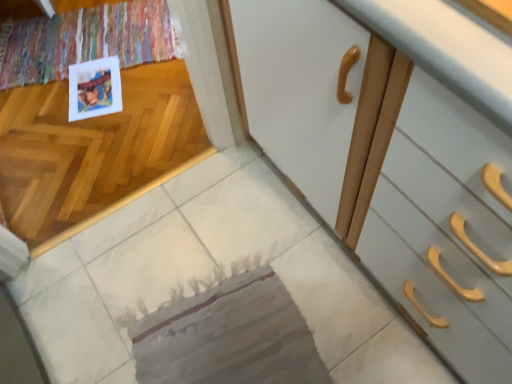
This screenshot has height=384, width=512. What are the coordinates of `vacant space underneath textured gray mat at center (from a real-world perspective)` in the screenshot? It's located at (229, 331).